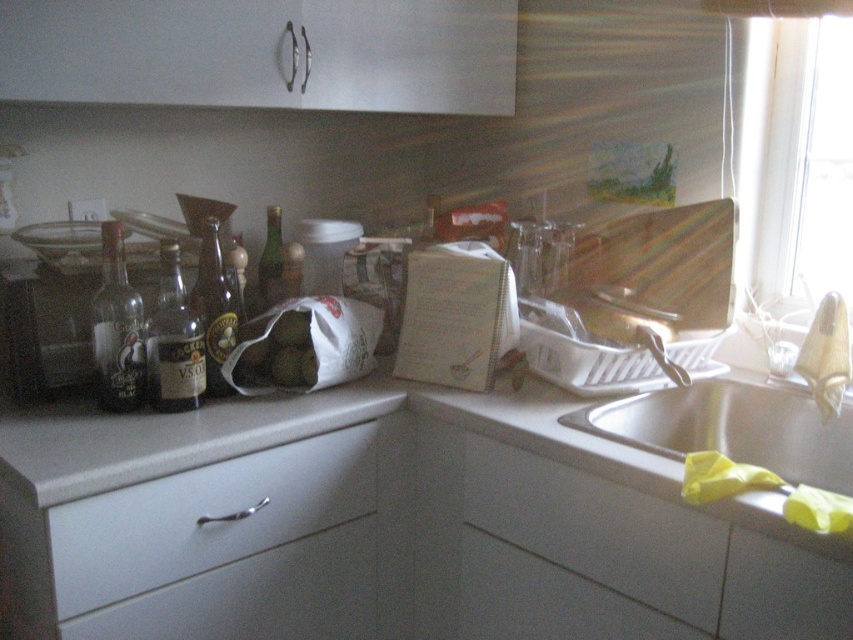
Question: Estimate the real-world distances between objects in this image. Which object is closer to the dark brown glass bottle at center?

Choices:
 (A) white matte countertop at center
 (B) stainless steel sink at lower right
 (C) clear glass bottle at left
 (D) white matte drawer at lower center

Answer: (C)

Question: Which object is positioned farthest from the dark brown glass bottle at center-left?

Choices:
 (A) white matte drawer at lower left
 (B) white matte drawer at lower center

Answer: (B)

Question: Does white matte drawer at lower center appear on the left side of stainless steel sink at lower right?

Choices:
 (A) yes
 (B) no

Answer: (A)

Question: Is the position of white matte countertop at center less distant than that of stainless steel sink at lower right?

Choices:
 (A) yes
 (B) no

Answer: (A)

Question: Is stainless steel sink at lower right wider than dark brown glass bottle at center?

Choices:
 (A) no
 (B) yes

Answer: (B)

Question: Among these points, which one is nearest to the camera?

Choices:
 (A) (61, 464)
 (B) (289, 512)
 (C) (271, 304)
 (D) (468, 477)

Answer: (A)